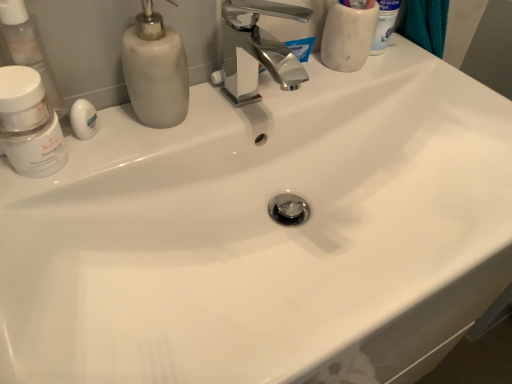
Where is `spots to the right of transparent plastic container at left, which is the 1th toiletry from bottom to top`? spots to the right of transparent plastic container at left, which is the 1th toiletry from bottom to top is located at coordinates (165, 129).